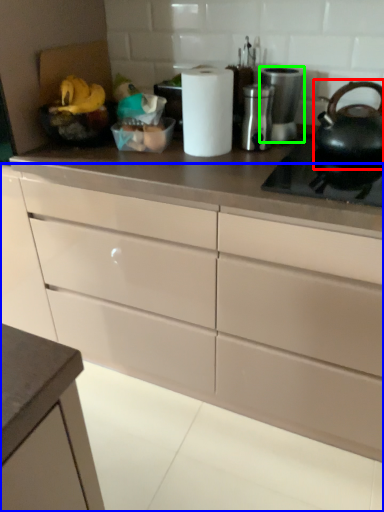
Question: Estimate the real-world distances between objects in this image. Which object is closer to tea pot (highlighted by a red box), cabinetry (highlighted by a blue box) or appliance (highlighted by a green box)?

Choices:
 (A) cabinetry
 (B) appliance

Answer: (B)